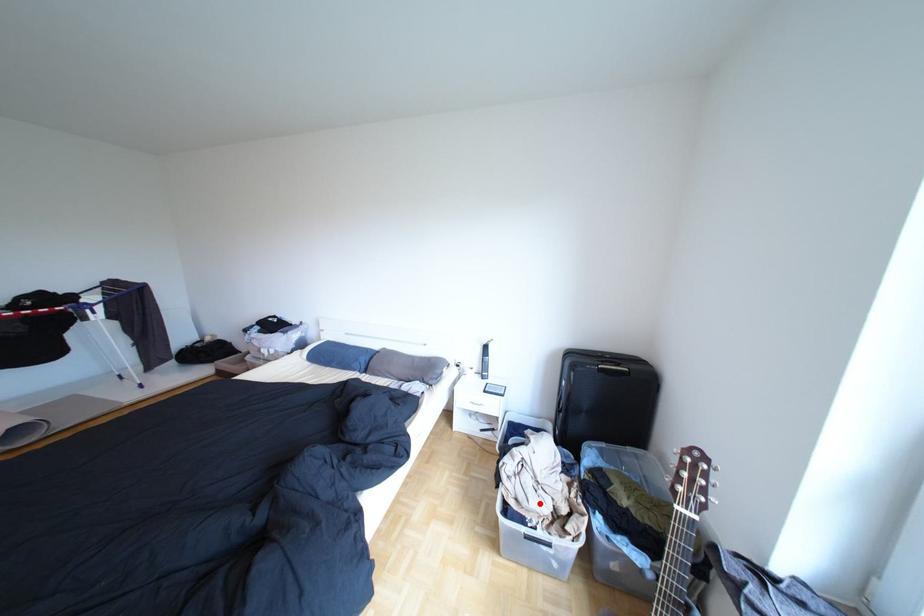
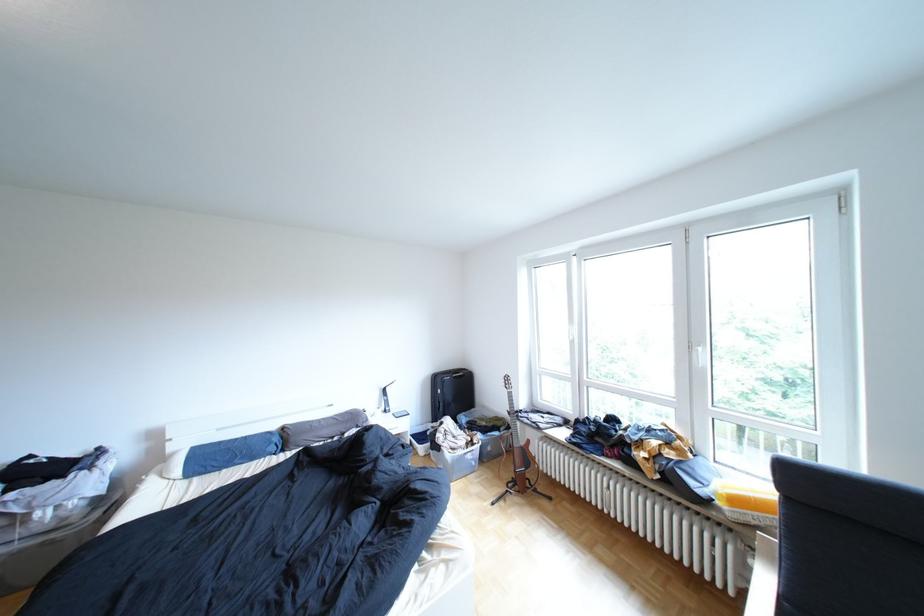
In the second image, find the point that corresponds to the highlighted location in the first image.

(470, 446)